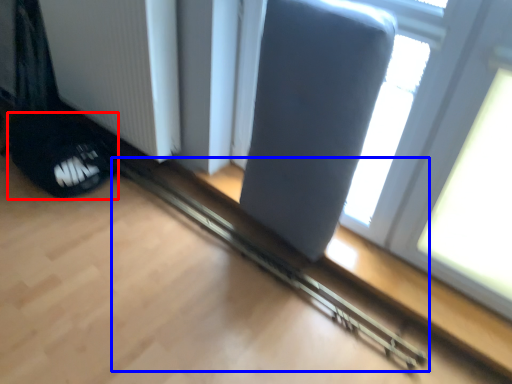
Question: Which object appears closest to the camera in this image, footwear (highlighted by a red box) or rail (highlighted by a blue box)?

Choices:
 (A) footwear
 (B) rail

Answer: (B)